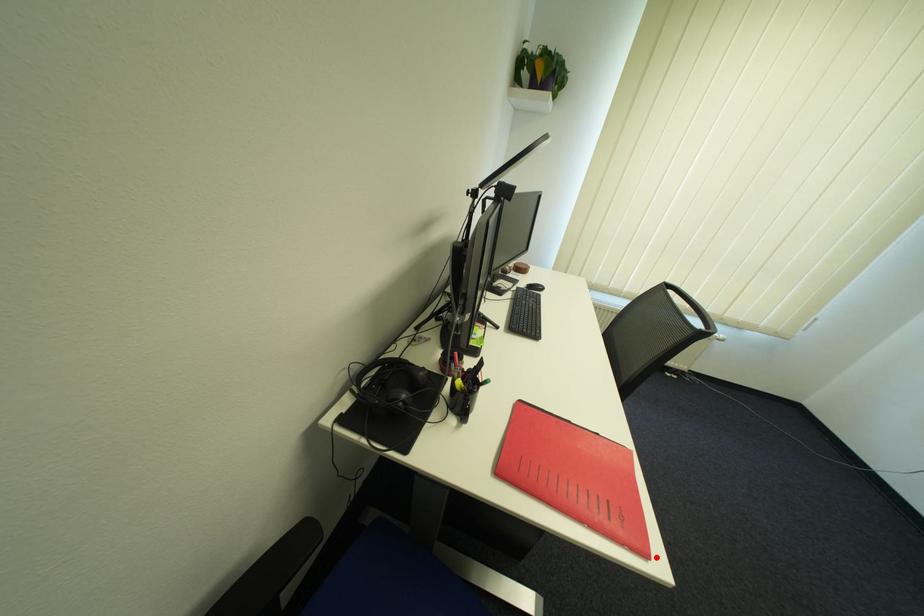
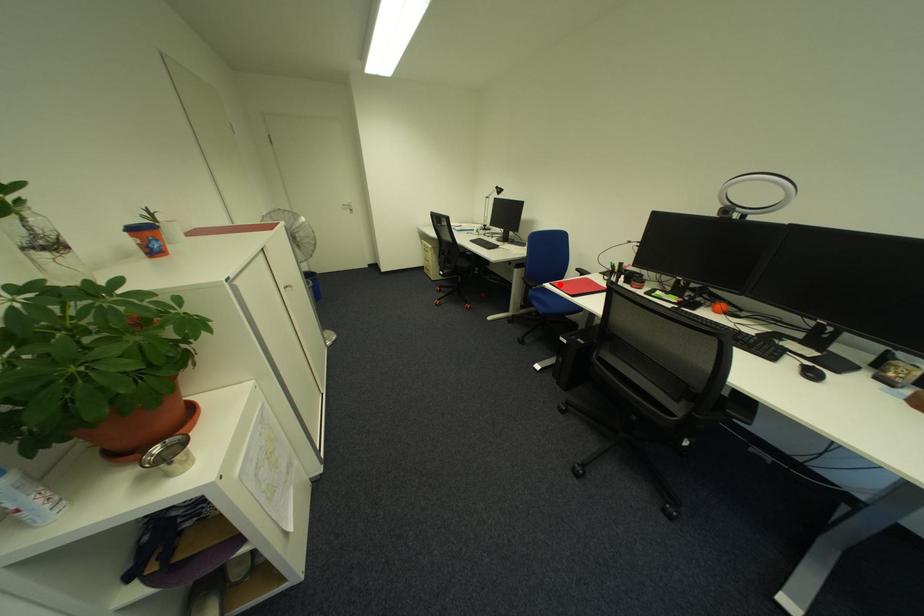
I am providing you with two images of the same scene from different viewpoints. A red point is marked on the first image and another point is marked on the second image. Is the marked point in image1 the same physical position as the marked point in image2?

Yes